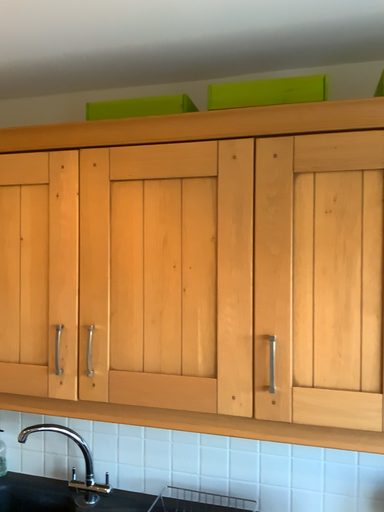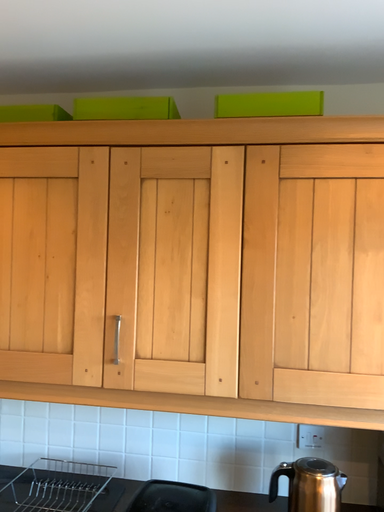
Question: How did the camera likely rotate when shooting the video?

Choices:
 (A) rotated left
 (B) rotated right

Answer: (B)